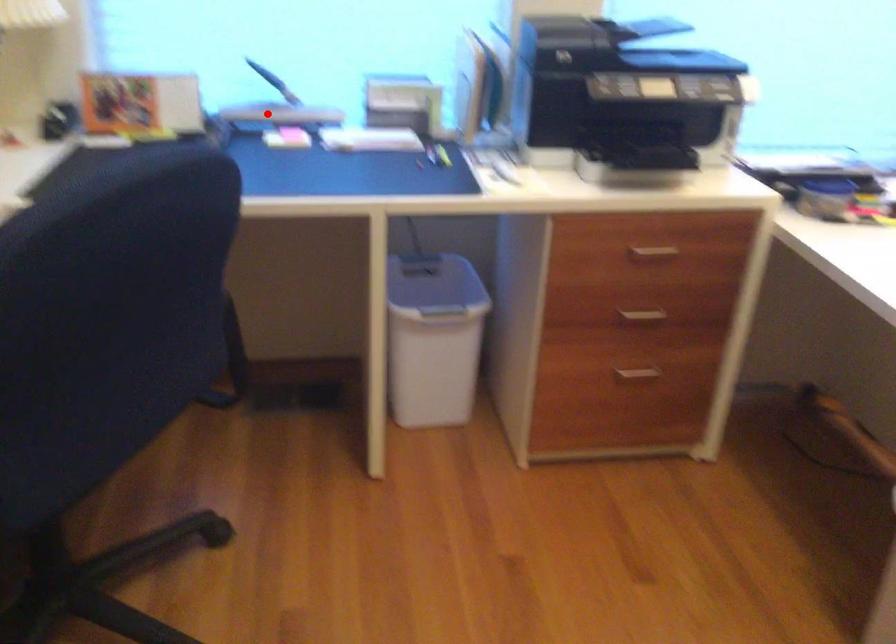
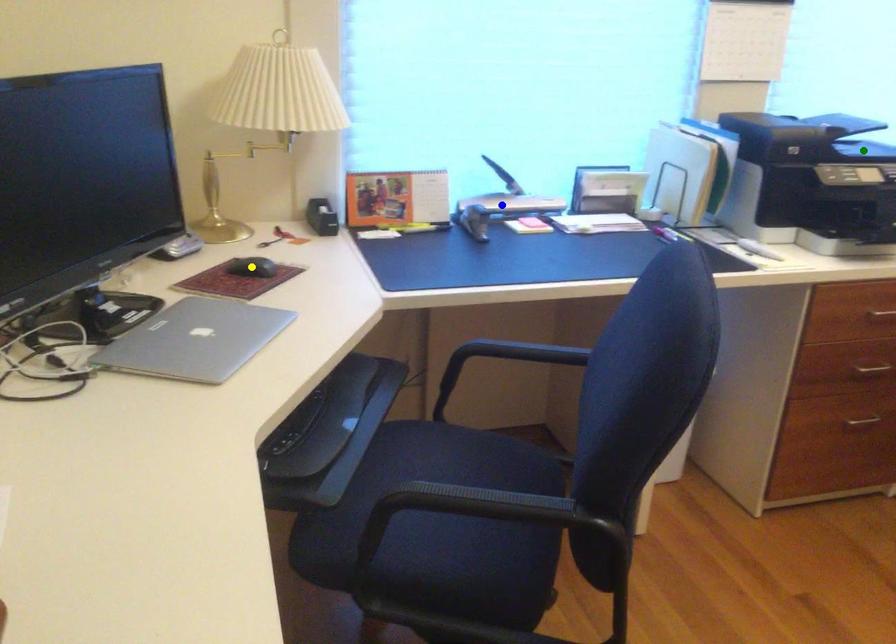
Question: I am providing you with two images of the same scene from different viewpoints. A red point is marked on the first image. You are given multiple points on the second image. In image 2, which mark is for the same physical point as the one in image 1?

Choices:
 (A) green point
 (B) yellow point
 (C) blue point

Answer: (C)